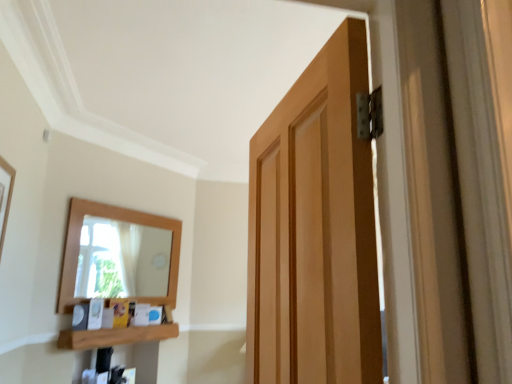
Question: In the image, is wooden picture frame at left positioned in front of or behind wooden at lower left?

Choices:
 (A) front
 (B) behind

Answer: (A)

Question: In terms of width, does wooden picture frame at left look wider or thinner when compared to wooden at lower left?

Choices:
 (A) wide
 (B) thin

Answer: (B)

Question: Visually, is wooden picture frame at left positioned to the left or to the right of wooden at lower left?

Choices:
 (A) left
 (B) right

Answer: (A)

Question: Considering their positions, is wooden at lower left located in front of or behind wooden picture frame at left?

Choices:
 (A) front
 (B) behind

Answer: (B)

Question: Is wooden at lower left taller or shorter than wooden picture frame at left?

Choices:
 (A) tall
 (B) short

Answer: (B)

Question: Is wooden at lower left to the left or to the right of wooden picture frame at left in the image?

Choices:
 (A) right
 (B) left

Answer: (A)

Question: Is point (137, 339) closer or farther from the camera than point (5, 206)?

Choices:
 (A) closer
 (B) farther

Answer: (B)